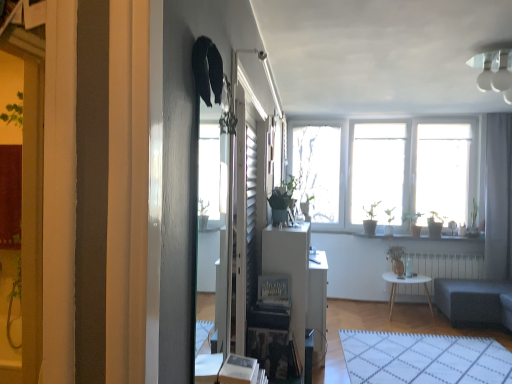
Question: From the image's perspective, is green matte plant at center, the 1th houseplant positioned from the left, above or below white glossy window sill at center?

Choices:
 (A) above
 (B) below

Answer: (A)

Question: Relative to white glossy window sill at center, is green matte plant at center, the 1th houseplant positioned from the left, in front or behind?

Choices:
 (A) behind
 (B) front

Answer: (B)

Question: Estimate the real-world distances between objects in this image. Which object is closer to the green matte plant at center, arranged as the second houseplant when viewed from the back?

Choices:
 (A) dark gray fabric studio couch at lower right
 (B) white glossy light fixture at upper right
 (C) gray fabric curtain at right
 (D) green matte plant at center, which is the second houseplant in front-to-back order
 (E) white grid rug at lower center

Answer: (B)

Question: Which object is the farthest from the white radiator at center?

Choices:
 (A) white glossy window sill at center
 (B) white glossy table at center
 (C) green matte plant at center, the 1th houseplant in the back-to-front sequence
 (D) dark gray fabric studio couch at lower right
 (E) white wooden table at center

Answer: (B)